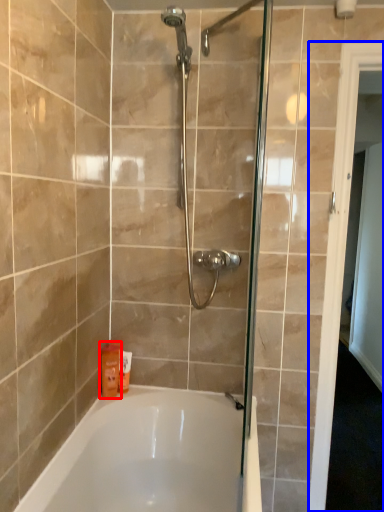
Question: Which of the following is the farthest to the observer, toiletry (highlighted by a red box) or screen door (highlighted by a blue box)?

Choices:
 (A) toiletry
 (B) screen door

Answer: (A)